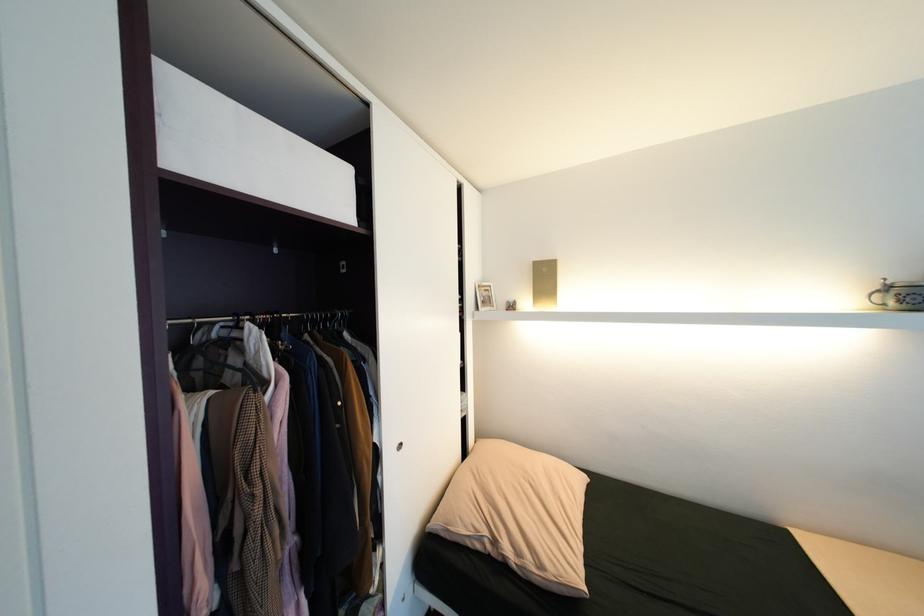
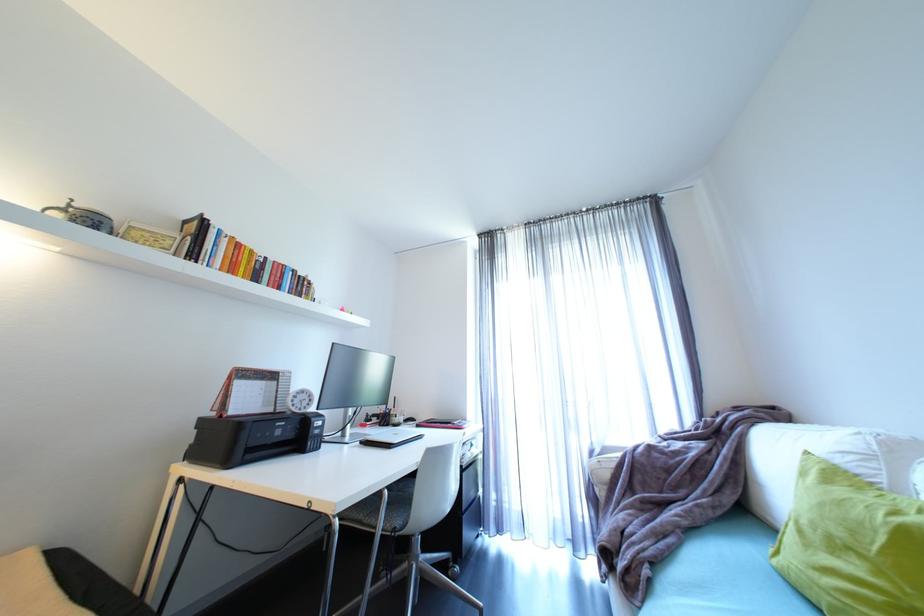
Locate, in the second image, the point that corresponds to pixel 885 288 in the first image.

(69, 206)